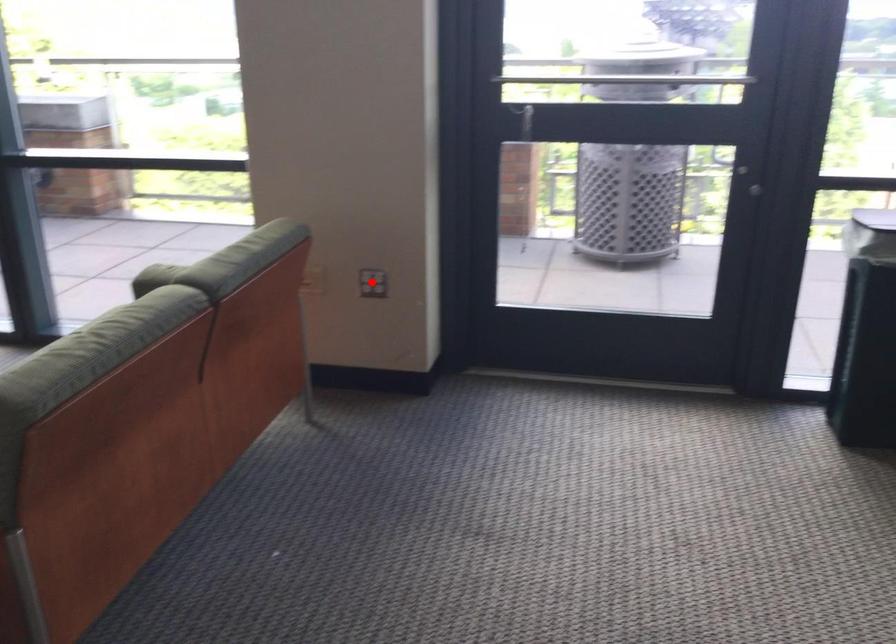
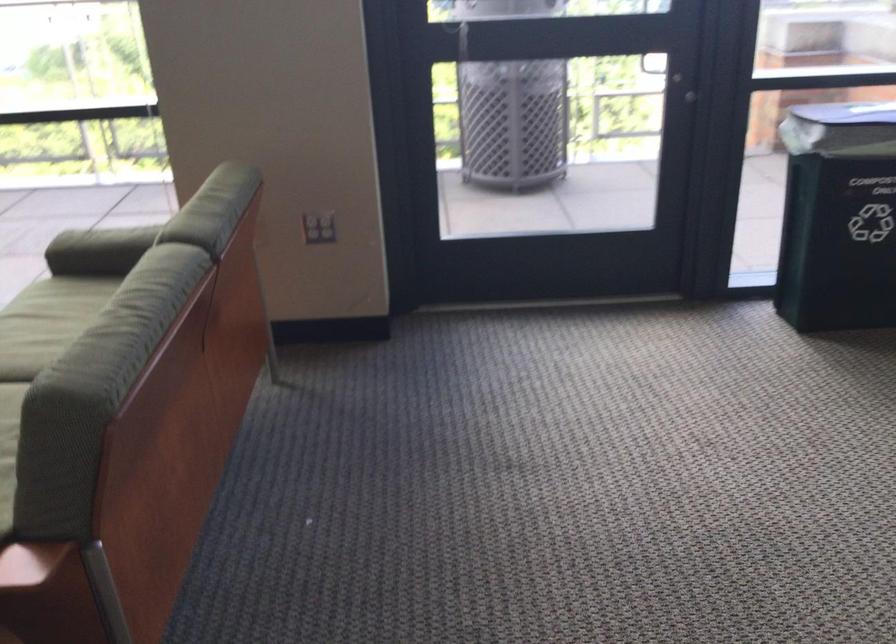
Where in the second image is the point corresponding to the highlighted location from the first image?

(319, 227)